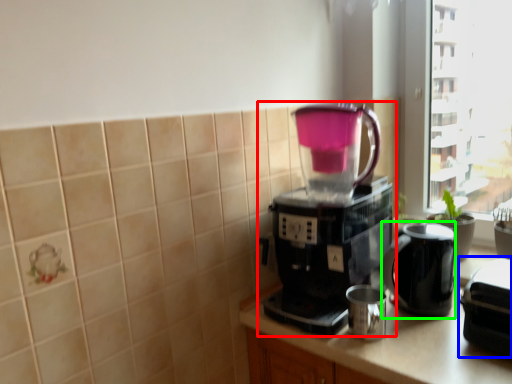
Question: Which object is positioned farthest from coffee maker (highlighted by a red box)? Select from appliance (highlighted by a blue box) and jug (highlighted by a green box).

Choices:
 (A) appliance
 (B) jug

Answer: (A)